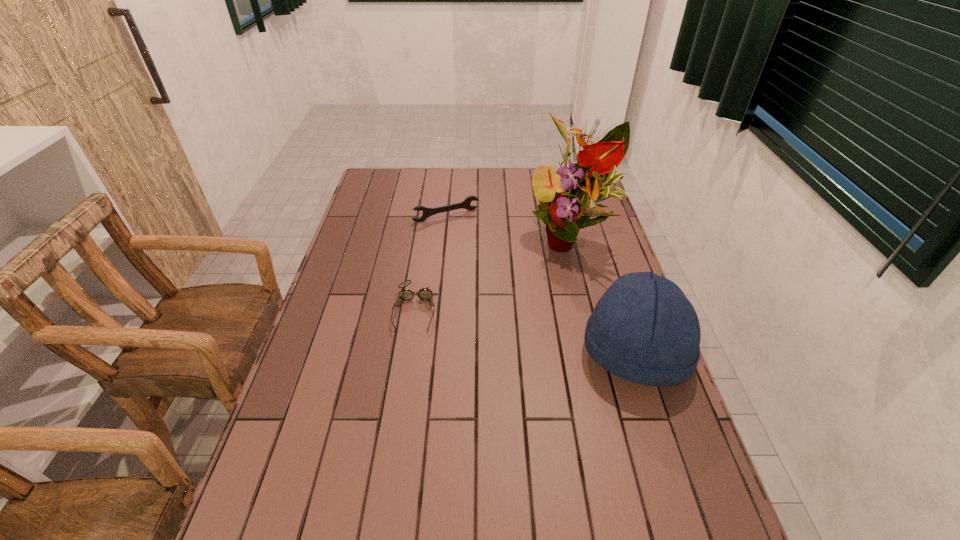
Find the location of a particular element. The height and width of the screenshot is (540, 960). free location that satisfies the following two spatial constraints: 1. on the front side of the wrench; 2. on the left side of the bouquet is located at coordinates (444, 241).

Locate an element on the screen. This screenshot has width=960, height=540. free space that satisfies the following two spatial constraints: 1. on the front-facing side of the third shortest object; 2. on the right side of the spectacles is located at coordinates (408, 354).

Where is `vacant space that satisfies the following two spatial constraints: 1. on the front side of the bouquet; 2. on the right side of the second shortest object`? The height and width of the screenshot is (540, 960). vacant space that satisfies the following two spatial constraints: 1. on the front side of the bouquet; 2. on the right side of the second shortest object is located at coordinates [x=444, y=241].

What are the coordinates of `free location that satisfies the following two spatial constraints: 1. on the front side of the skullcap; 2. on the left side of the tallest object` in the screenshot? It's located at (598, 354).